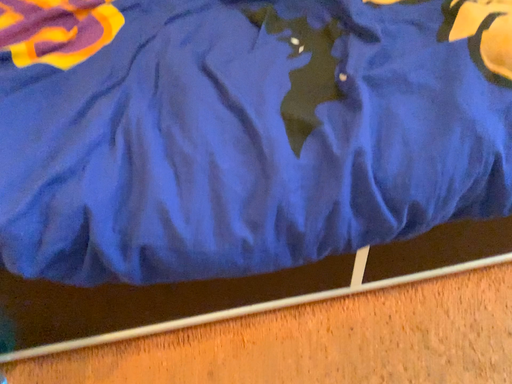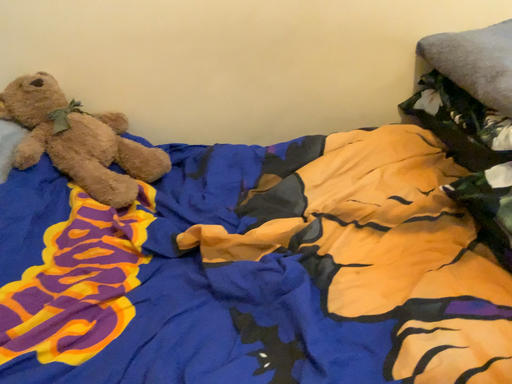
Question: Which way did the camera rotate in the video?

Choices:
 (A) rotated downward
 (B) rotated upward

Answer: (B)